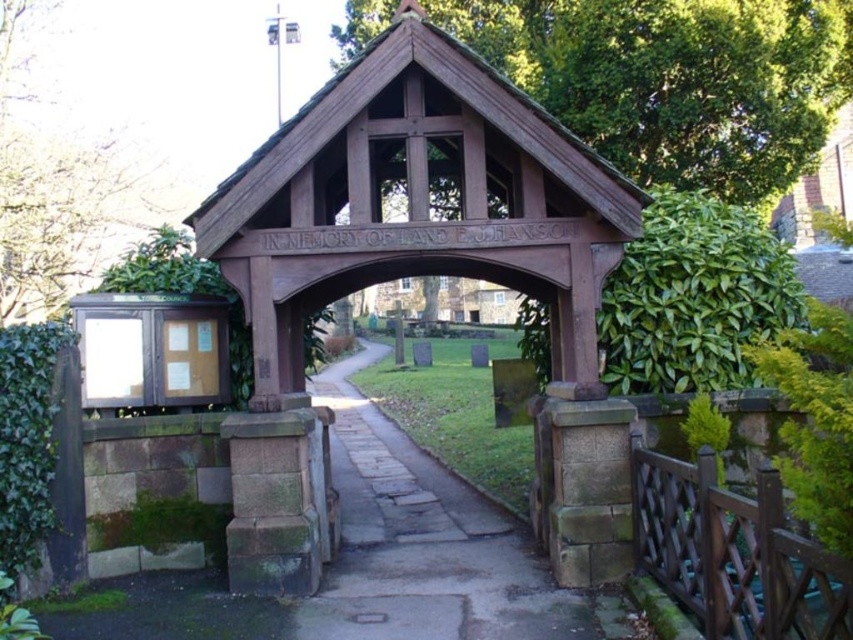
You are standing at the entrance of the lych gate and want to take a photo. You notice two points marked on the gate at coordinates point (633, 196) and point (9, 256). Which point will appear larger in your camera view?

Point (633, 196) will appear larger in the camera view because it is closer to the camera than point (9, 256).

You are standing in a garden and want to walk towards the wooden gazebo at center. Which direction should you move relative to the paved stone path at center?

The paved stone path at center is behind the wooden gazebo at center, so you should move forward towards the wooden gazebo at center, away from the paved stone path at center.